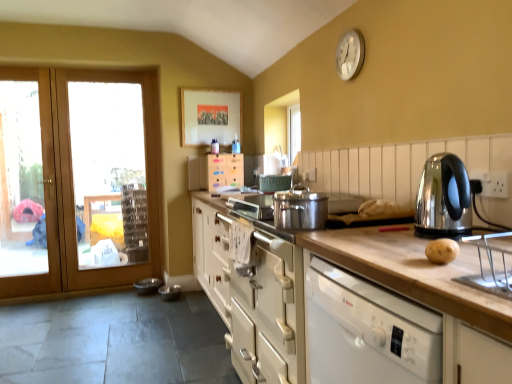
Where is `vacant location below metallic stainless steel bowl at lower left, acting as the first appliance starting from the left (from a real-world perspective)`? This screenshot has width=512, height=384. vacant location below metallic stainless steel bowl at lower left, acting as the first appliance starting from the left (from a real-world perspective) is located at coordinates (151, 284).